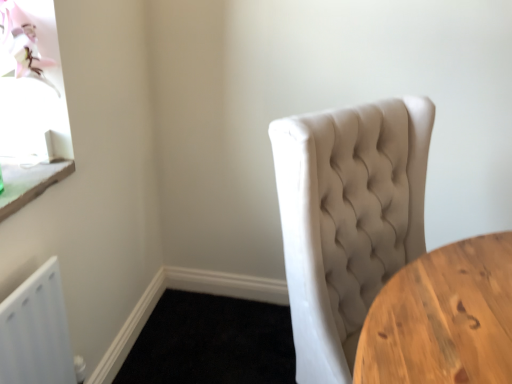
You are a GUI agent. You are given a task and a screenshot of the screen. Output one action in this format:
    pyautogui.click(x=<x>, y=<y>)
    Task: Click on the beige tufted chair at center
    The height and width of the screenshot is (384, 512).
    Given the screenshot: What is the action you would take?
    pyautogui.click(x=347, y=219)

The height and width of the screenshot is (384, 512). What do you see at coordinates (347, 219) in the screenshot? I see `beige tufted chair at center` at bounding box center [347, 219].

Identify the location of beige tufted chair at center. (347, 219).